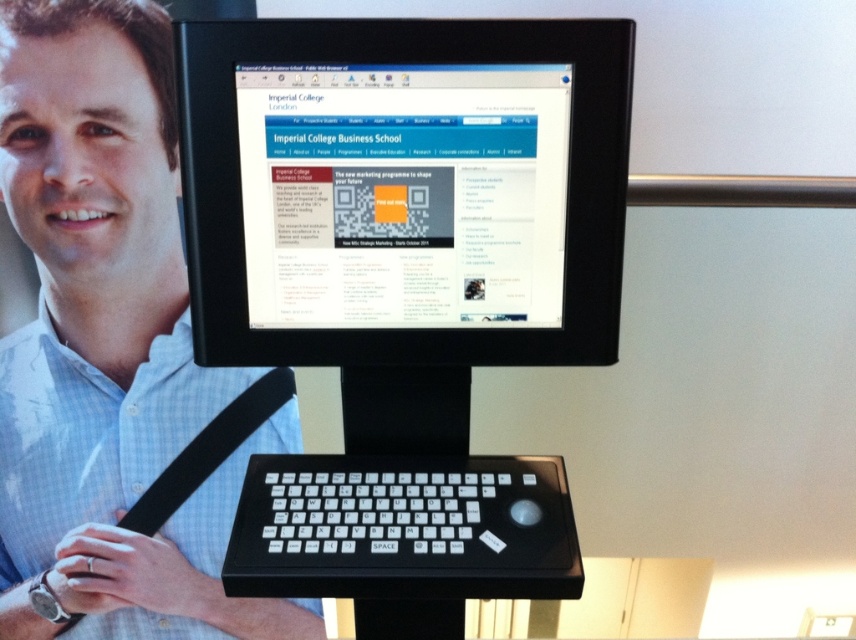
Question: Does matte black keyboard at lower center appear over black plastic keyboard at center?

Choices:
 (A) no
 (B) yes

Answer: (B)

Question: Which point appears closest to the camera in this image?

Choices:
 (A) (64, 161)
 (B) (296, 348)

Answer: (B)

Question: Among these objects, which one is nearest to the camera?

Choices:
 (A) black plastic monitor at center
 (B) black plastic keyboard at center
 (C) matte black keyboard at lower center

Answer: (B)

Question: Based on their relative distances, which object is nearer to the black plastic monitor at center?

Choices:
 (A) matte black keyboard at lower center
 (B) black plastic keyboard at center

Answer: (B)

Question: Is black plastic monitor at center wider than black plastic keyboard at center?

Choices:
 (A) yes
 (B) no

Answer: (A)

Question: From the image, what is the correct spatial relationship of black plastic monitor at center in relation to matte black keyboard at lower center?

Choices:
 (A) below
 (B) above

Answer: (B)